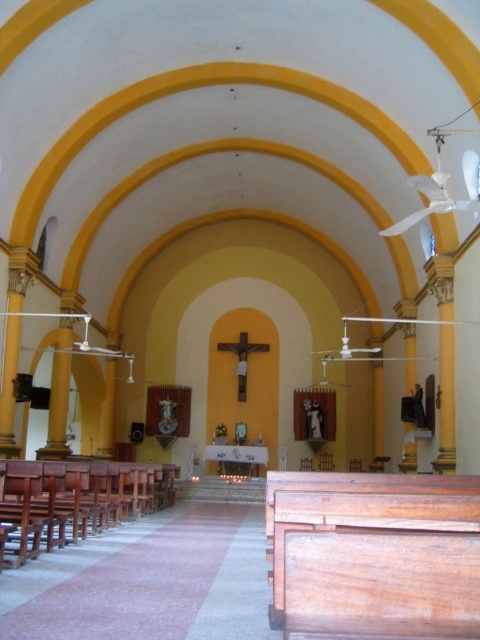
Question: Is wooden church bench at lower right bigger than wooden church bench at left?

Choices:
 (A) yes
 (B) no

Answer: (A)

Question: Is wooden church bench at lower right closer to the viewer compared to wooden church bench at left?

Choices:
 (A) no
 (B) yes

Answer: (B)

Question: Which of the following is the closest to the observer?

Choices:
 (A) wooden church bench at left
 (B) wooden church bench at lower right

Answer: (B)

Question: Which of the following is the closest to the observer?

Choices:
 (A) wooden church bench at left
 (B) wooden church bench at lower right

Answer: (B)

Question: Which point is closer to the camera?

Choices:
 (A) wooden church bench at lower right
 (B) wooden church bench at left

Answer: (A)

Question: Can you confirm if wooden church bench at lower right is wider than wooden church bench at left?

Choices:
 (A) no
 (B) yes

Answer: (B)